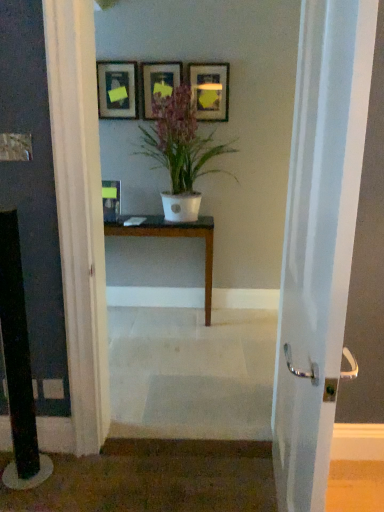
What is the approximate width of dark brown wood table at center?

It is 14.79 inches.

Find the location of a particular element. This screenshot has height=512, width=384. matte black picture frame at upper left, which appears as the 2th picture frame when viewed from the left is located at coordinates (117, 90).

Describe the element at coordinates (158, 83) in the screenshot. I see `matte black picture frame at upper center, arranged as the third picture frame when viewed from the left` at that location.

Describe the element at coordinates (210, 90) in the screenshot. I see `matte black picture frame at upper center, the first picture frame when ordered from right to left` at that location.

This screenshot has width=384, height=512. I want to click on matte black picture frame at center, which ranks as the first picture frame in left-to-right order, so click(111, 200).

Describe the element at coordinates (111, 200) in the screenshot. I see `matte black picture frame at center, which ranks as the first picture frame in left-to-right order` at that location.

At what (x,y) coordinates should I click in order to perform the action: click on white glossy door handle at center. Please return your answer as a coordinate pair (x, y). This screenshot has height=512, width=384. Looking at the image, I should click on (319, 242).

Which of these two, matte black picture frame at upper left, which appears as the 2th picture frame when viewed from the left, or white glossy door handle at center, stands shorter?

Standing shorter between the two is matte black picture frame at upper left, which appears as the 2th picture frame when viewed from the left.

Is point (100, 70) closer or farther from the camera than point (336, 339)?

Point (100, 70) is farther from the camera than point (336, 339).

Is matte black picture frame at upper left, the third picture frame in the right-to-left sequence, to the left or to the right of white glossy door handle at center in the image?

Based on their positions, matte black picture frame at upper left, the third picture frame in the right-to-left sequence, is located to the left of white glossy door handle at center.

Between dark brown wood table at center and matte black picture frame at upper center, the 4th picture frame viewed from the left, which one appears on the right side from the viewer's perspective?

matte black picture frame at upper center, the 4th picture frame viewed from the left, is more to the right.

Are dark brown wood table at center and matte black picture frame at upper center, the 4th picture frame viewed from the left, making contact?

dark brown wood table at center and matte black picture frame at upper center, the 4th picture frame viewed from the left, are clearly separated.

Is matte black picture frame at upper center, the 4th picture frame viewed from the left, completely or partially inside dark brown wood table at center?

Actually, matte black picture frame at upper center, the 4th picture frame viewed from the left, is outside dark brown wood table at center.

Between matte black picture frame at center, which ranks as the first picture frame in left-to-right order, and matte black picture frame at upper center, the first picture frame when ordered from right to left, which one has larger size?

matte black picture frame at upper center, the first picture frame when ordered from right to left.

From the matte black picture frame at center, which ranks as the first picture frame in left-to-right order, count 3rd picture frame to the right and point to it. Please provide its 2D coordinates.

[(210, 90)]

Is point (118, 207) more distant than point (215, 110)?

Yes.

Which object is closer to the camera, matte black picture frame at center, which ranks as the first picture frame in left-to-right order, or matte black picture frame at upper center, the 4th picture frame viewed from the left?

matte black picture frame at upper center, the 4th picture frame viewed from the left, is closer to the camera.

Considering the positions of points (222, 93) and (106, 193), is point (222, 93) farther from camera compared to point (106, 193)?

That is False.

Is matte black picture frame at upper center, the 4th picture frame viewed from the left, at the right side of matte black picture frame at center, which is counted as the fourth picture frame, starting from the right?

Indeed, matte black picture frame at upper center, the 4th picture frame viewed from the left, is positioned on the right side of matte black picture frame at center, which is counted as the fourth picture frame, starting from the right.

From a real-world perspective, is matte black picture frame at upper center, the first picture frame when ordered from right to left, under matte black picture frame at center, which ranks as the first picture frame in left-to-right order?

Actually, matte black picture frame at upper center, the first picture frame when ordered from right to left, is physically above matte black picture frame at center, which ranks as the first picture frame in left-to-right order, in the real world.

From the image's perspective, is matte black picture frame at upper center, arranged as the third picture frame when viewed from the left, located above or below white matte pot at center?

matte black picture frame at upper center, arranged as the third picture frame when viewed from the left, is above white matte pot at center.

Considering the positions of objects matte black picture frame at upper center, acting as the 2th picture frame starting from the right, and white matte pot at center in the image provided, who is more to the right, matte black picture frame at upper center, acting as the 2th picture frame starting from the right, or white matte pot at center?

Positioned to the right is white matte pot at center.

Between matte black picture frame at upper center, arranged as the third picture frame when viewed from the left, and white matte pot at center, which one is positioned in front?

Positioned in front is white matte pot at center.

Consider the image. Is matte black picture frame at upper center, arranged as the third picture frame when viewed from the left, bigger or smaller than white matte pot at center?

Clearly, matte black picture frame at upper center, arranged as the third picture frame when viewed from the left, is smaller in size than white matte pot at center.

Which object is positioned more to the right, white matte pot at center or dark brown wood table at center?

white matte pot at center is more to the right.

Looking at this image, can you confirm if white matte pot at center is bigger than dark brown wood table at center?

Correct, white matte pot at center is larger in size than dark brown wood table at center.

Considering the relative sizes of white matte pot at center and dark brown wood table at center in the image provided, is white matte pot at center thinner than dark brown wood table at center?

No.

Is point (192, 151) closer to camera compared to point (206, 239)?

That is True.

Does point (220, 109) lie in front of point (168, 72)?

No.

Is matte black picture frame at upper center, the first picture frame when ordered from right to left, not close to matte black picture frame at upper center, arranged as the third picture frame when viewed from the left?

No, matte black picture frame at upper center, the first picture frame when ordered from right to left, is not far away from matte black picture frame at upper center, arranged as the third picture frame when viewed from the left.

The image size is (384, 512). I want to click on picture frame on the right side of matte black picture frame at upper center, arranged as the third picture frame when viewed from the left, so click(x=210, y=90).

Considering the positions of objects matte black picture frame at upper center, the first picture frame when ordered from right to left, and matte black picture frame at upper center, arranged as the third picture frame when viewed from the left, in the image provided, who is behind, matte black picture frame at upper center, the first picture frame when ordered from right to left, or matte black picture frame at upper center, arranged as the third picture frame when viewed from the left,?

matte black picture frame at upper center, arranged as the third picture frame when viewed from the left, is further from the camera.

Locate an element on the screen. Image resolution: width=384 pixels, height=512 pixels. picture frame that is the 3rd one when counting leftward from the white glossy door handle at center is located at coordinates (117, 90).

Where is `table that appears below the matte black picture frame at upper center, the first picture frame when ordered from right to left (from a real-world perspective)`? table that appears below the matte black picture frame at upper center, the first picture frame when ordered from right to left (from a real-world perspective) is located at coordinates (173, 237).

Estimate the real-world distances between objects in this image. Which object is further from matte black picture frame at upper left, the third picture frame in the right-to-left sequence, matte black picture frame at upper center, the first picture frame when ordered from right to left, or matte black picture frame at center, which ranks as the first picture frame in left-to-right order?

Among the two, matte black picture frame at center, which ranks as the first picture frame in left-to-right order, is located further to matte black picture frame at upper left, the third picture frame in the right-to-left sequence.

Which object lies further to the anchor point white glossy door handle at center, matte black picture frame at center, which is counted as the fourth picture frame, starting from the right, or matte black picture frame at upper left, which appears as the 2th picture frame when viewed from the left?

matte black picture frame at upper left, which appears as the 2th picture frame when viewed from the left, is positioned further to the anchor white glossy door handle at center.

Estimate the real-world distances between objects in this image. Which object is further from dark brown wood table at center, matte black picture frame at upper center, acting as the 2th picture frame starting from the right, or white matte pot at center?

The object further to dark brown wood table at center is matte black picture frame at upper center, acting as the 2th picture frame starting from the right.

Based on their spatial positions, is matte black picture frame at upper left, the third picture frame in the right-to-left sequence, or matte black picture frame at upper center, the 4th picture frame viewed from the left, further from white matte pot at center?

matte black picture frame at upper left, the third picture frame in the right-to-left sequence, lies further to white matte pot at center than the other object.

Estimate the real-world distances between objects in this image. Which object is further from matte black picture frame at center, which ranks as the first picture frame in left-to-right order, matte black picture frame at upper center, the first picture frame when ordered from right to left, or dark brown wood table at center?

matte black picture frame at upper center, the first picture frame when ordered from right to left, is positioned further to the anchor matte black picture frame at center, which ranks as the first picture frame in left-to-right order.

From the image, which object appears to be nearer to dark brown wood table at center, matte black picture frame at upper center, arranged as the third picture frame when viewed from the left, or matte black picture frame at upper left, which appears as the 2th picture frame when viewed from the left?

matte black picture frame at upper left, which appears as the 2th picture frame when viewed from the left.

Based on their spatial positions, is white glossy door handle at center or dark brown wood table at center further from matte black picture frame at upper center, arranged as the third picture frame when viewed from the left?

Based on the image, white glossy door handle at center appears to be further to matte black picture frame at upper center, arranged as the third picture frame when viewed from the left.

Which object lies nearer to the anchor point matte black picture frame at upper center, the first picture frame when ordered from right to left, matte black picture frame at center, which ranks as the first picture frame in left-to-right order, or matte black picture frame at upper center, acting as the 2th picture frame starting from the right?

Among the two, matte black picture frame at upper center, acting as the 2th picture frame starting from the right, is located nearer to matte black picture frame at upper center, the first picture frame when ordered from right to left.

Identify the location of houseplant between matte black picture frame at upper left, the third picture frame in the right-to-left sequence, and matte black picture frame at upper center, the first picture frame when ordered from right to left, from left to right. This screenshot has width=384, height=512. (179, 152).

Locate an element on the screen. The image size is (384, 512). table positioned between white glossy door handle at center and matte black picture frame at upper left, the third picture frame in the right-to-left sequence, from near to far is located at coordinates (173, 237).

This screenshot has width=384, height=512. In order to click on houseplant that lies between matte black picture frame at upper center, acting as the 2th picture frame starting from the right, and matte black picture frame at center, which ranks as the first picture frame in left-to-right order, from top to bottom in this screenshot , I will do `click(179, 152)`.

In order to click on houseplant positioned between white glossy door handle at center and matte black picture frame at upper center, the 4th picture frame viewed from the left, from near to far in this screenshot , I will do `click(179, 152)`.